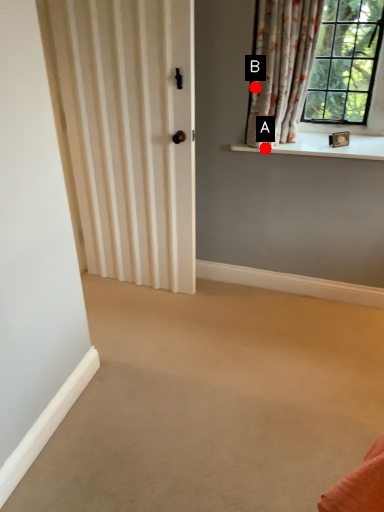
Question: Two points are circled on the image, labeled by A and B beside each circle. Which of the following is the farthest from the observer?

Choices:
 (A) A is further
 (B) B is further

Answer: (A)